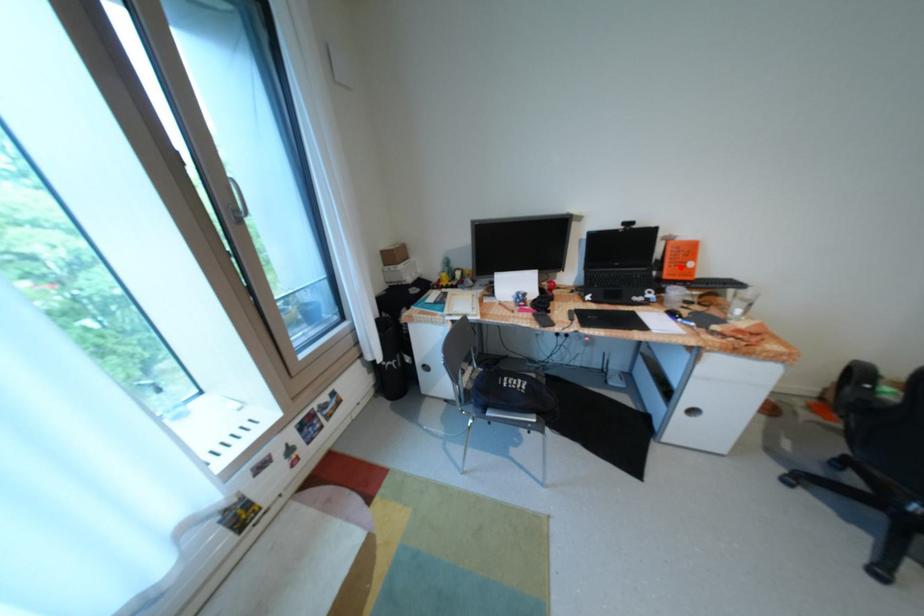
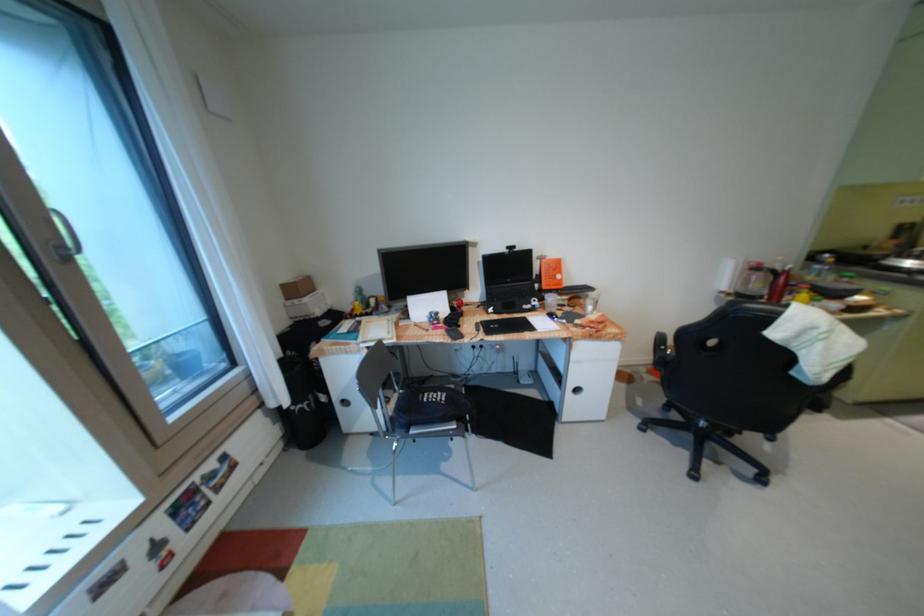
Locate, in the second image, the point that corresponds to the highlighted location in the first image.

(555, 280)